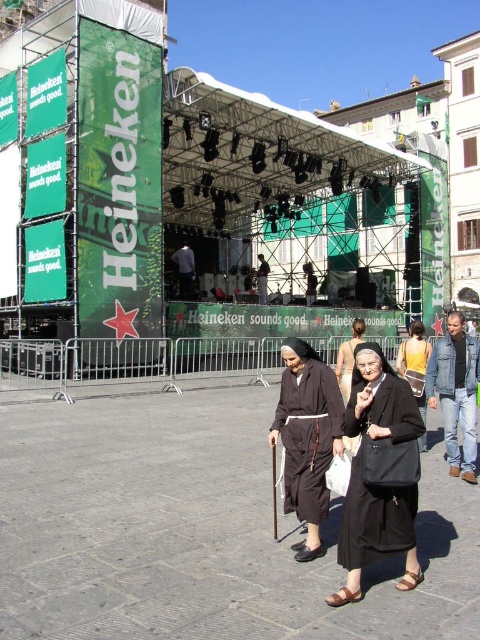
You are a photographer at the event and need to capture both the black fabric dress at center and the dark blue jeans at center in a single frame. Which one will appear bigger in the photo?

The black fabric dress at center will appear bigger in the photo because it is larger in size than the dark blue jeans at center.

You are a photographer standing in the square and want to take a photo of the denim jacket at lower right and the dark brown fabric robe at center. Which object should you focus on first if you want both to be in sharp focus?

The denim jacket at lower right is closer to the viewer than the dark brown fabric robe at center, so you should focus on the denim jacket at lower right first to ensure both are in sharp focus.